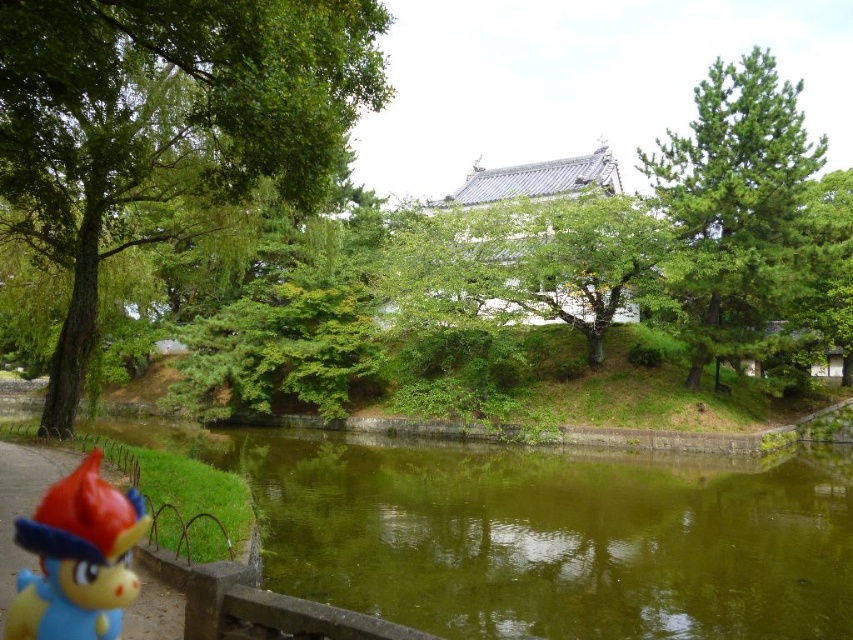
Is green leafy tree at left to the left of green needle-like at upper right from the viewer's perspective?

Indeed, green leafy tree at left is positioned on the left side of green needle-like at upper right.

Which is below, green leafy tree at left or green needle-like at upper right?

green leafy tree at left is below.

Which is in front, point (267, 72) or point (654, 189)?

Point (267, 72) is in front.

Where is `green leafy tree at left`? Image resolution: width=853 pixels, height=640 pixels. green leafy tree at left is located at coordinates (165, 124).

You are a GUI agent. You are given a task and a screenshot of the screen. Output one action in this format:
    pyautogui.click(x=<x>, y=<y>)
    Task: Click on the green water at center
    Image resolution: width=853 pixels, height=640 pixels.
    Given the screenshot: What is the action you would take?
    pyautogui.click(x=543, y=532)

Can you confirm if green water at center is positioned below green needle-like at upper right?

Yes, green water at center is below green needle-like at upper right.

Is point (263, 570) farther from camera compared to point (714, 227)?

No, it is in front of (714, 227).

What are the coordinates of `green water at center` in the screenshot? It's located at (543, 532).

Is green leafy tree at left shorter than rubberized blue toy at lower left?

Incorrect, green leafy tree at left's height does not fall short of rubberized blue toy at lower left's.

Can you confirm if green leafy tree at left is bigger than rubberized blue toy at lower left?

Indeed, green leafy tree at left has a larger size compared to rubberized blue toy at lower left.

Image resolution: width=853 pixels, height=640 pixels. Find the location of `green leafy tree at left`. green leafy tree at left is located at coordinates (165, 124).

The height and width of the screenshot is (640, 853). I want to click on green leafy tree at left, so click(x=165, y=124).